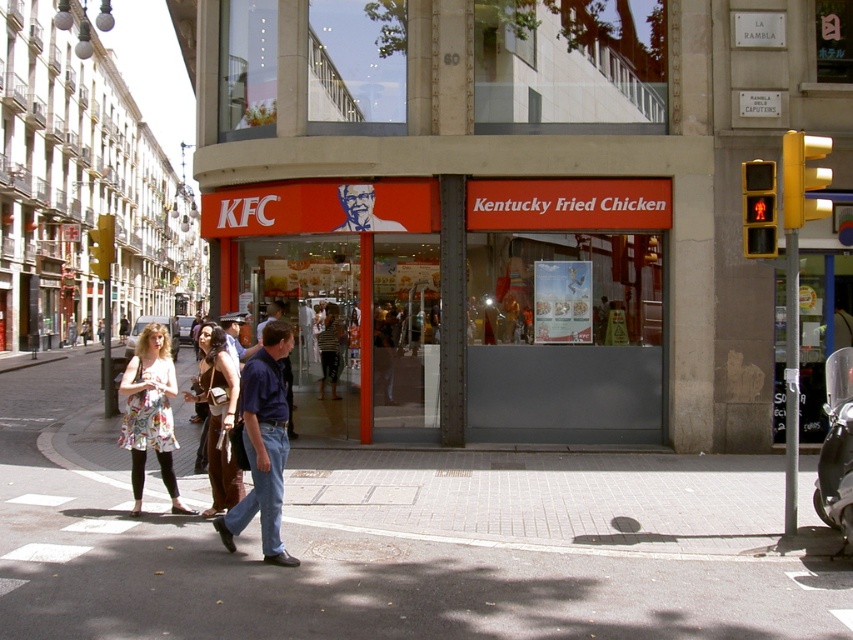
You are a photographer taking pictures of the KFC restaurant. You notice two women wearing floral dresses in the scene. One is wearing a floral dress at center and the other a floral dress at lower left. Which woman is closer to the camera?

The floral dress at center is bigger than the floral dress at lower left, so the woman wearing the floral dress at center is closer to the camera.